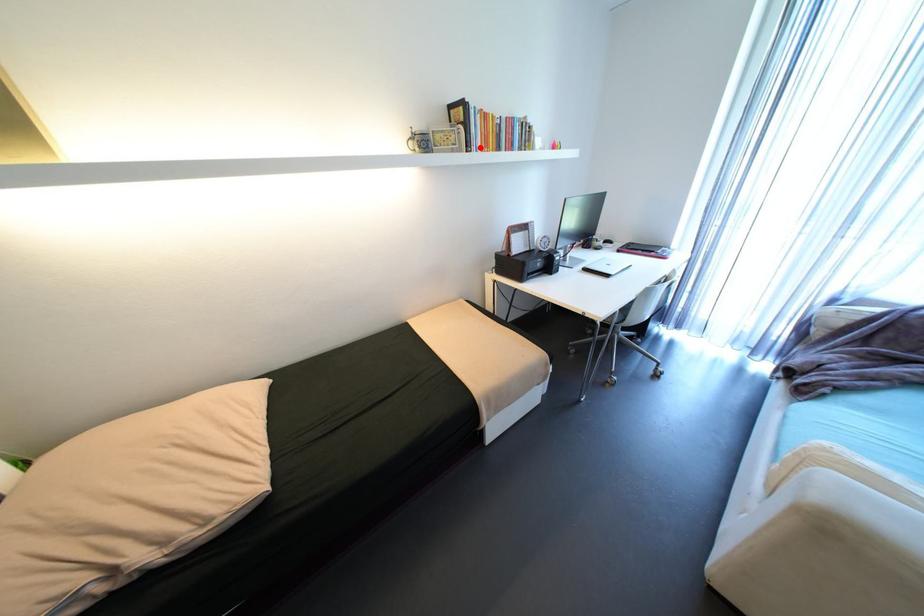
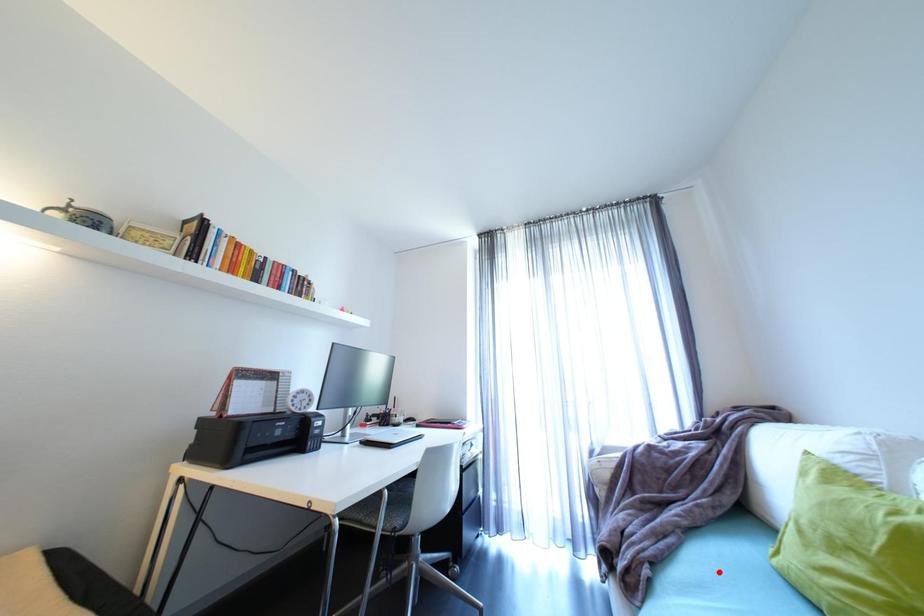
I am providing you with two images of the same scene from different viewpoints. A red point is marked on the first image and another point is marked on the second image. Are the points marked in image1 and image2 representing the same 3D position?

No